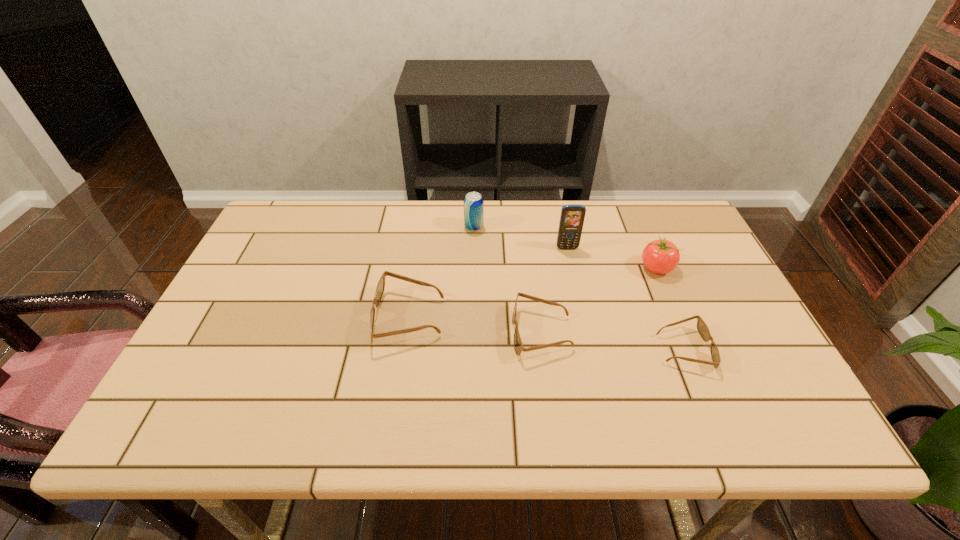
Please point a spot to add another sunglasses on the left. Please provide its 2D coordinates. Your answer should be formatted as a tuple, i.e. [(x, y)], where the tuple contains the x and y coordinates of a point satisfying the conditions above.

[(284, 303)]